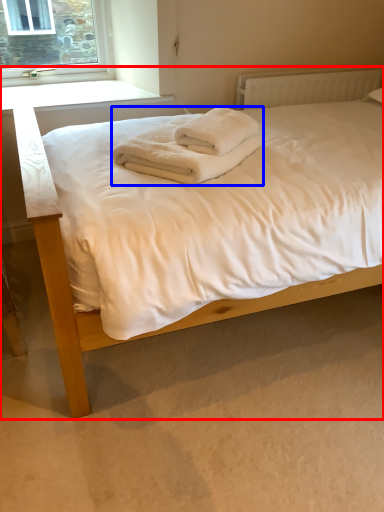
Question: Which point is closer to the camera, bed (highlighted by a red box) or bath towel (highlighted by a blue box)?

Choices:
 (A) bed
 (B) bath towel

Answer: (A)